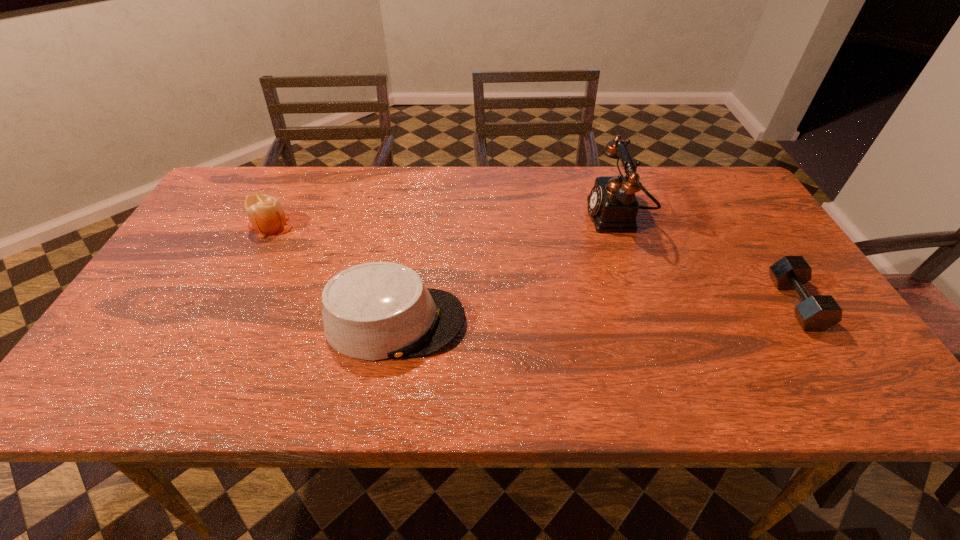
You are a GUI agent. You are given a task and a screenshot of the screen. Output one action in this format:
    pyautogui.click(x=<x>, y=<y>)
    Task: Click on the vacant space situated on the front-facing side of the second object from left to right
    
    Given the screenshot: What is the action you would take?
    pyautogui.click(x=632, y=322)

The width and height of the screenshot is (960, 540). What are the coordinates of `free location located on the left of the rightmost object` in the screenshot? It's located at (722, 303).

I want to click on telephone located in the far edge section of the desktop, so click(613, 206).

This screenshot has height=540, width=960. Find the location of `candle that is at the far edge`. candle that is at the far edge is located at coordinates (265, 213).

This screenshot has width=960, height=540. What are the coordinates of `object located at the left edge` in the screenshot? It's located at (265, 213).

Locate an element on the screen. This screenshot has height=540, width=960. object present at the right edge is located at coordinates (817, 312).

Where is `object present at the far left corner`? object present at the far left corner is located at coordinates (265, 213).

I want to click on vacant region at the far edge, so click(649, 201).

You are a GUI agent. You are given a task and a screenshot of the screen. Output one action in this format:
    pyautogui.click(x=<x>, y=<y>)
    Task: Click on the blank space at the near edge of the desktop
    This screenshot has width=960, height=540.
    Given the screenshot: What is the action you would take?
    pyautogui.click(x=181, y=402)

Locate an element on the screen. vacant space at the right edge of the desktop is located at coordinates (825, 348).